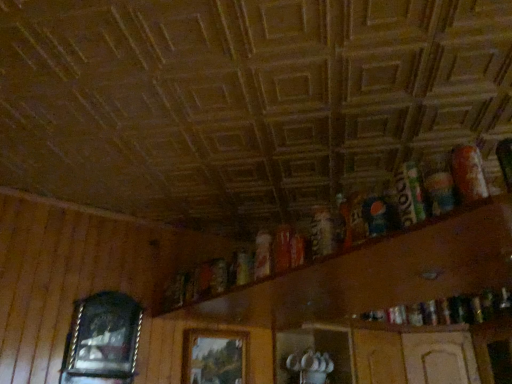
Question: Does wooden cabinet at lower center, which ranks as the first shelf in left-to-right order, have a greater height compared to wooden shelf at upper right, the 2th shelf in the left-to-right sequence?

Choices:
 (A) no
 (B) yes

Answer: (B)

Question: Is wooden cabinet at lower center, marked as the 2th shelf in a right-to-left arrangement, at the left side of wooden shelf at upper right, the 2th shelf in the left-to-right sequence?

Choices:
 (A) no
 (B) yes

Answer: (B)

Question: Is wooden cabinet at lower center, marked as the 2th shelf in a right-to-left arrangement, closer to camera compared to wooden shelf at upper right, the 2th shelf in the left-to-right sequence?

Choices:
 (A) yes
 (B) no

Answer: (B)

Question: Is wooden cabinet at lower center, marked as the 2th shelf in a right-to-left arrangement, outside wooden shelf at upper right, the 2th shelf in the left-to-right sequence?

Choices:
 (A) yes
 (B) no

Answer: (A)

Question: From a real-world perspective, is wooden cabinet at lower center, which ranks as the first shelf in left-to-right order, positioned over wooden shelf at upper right, the 1th shelf from the right, based on gravity?

Choices:
 (A) yes
 (B) no

Answer: (B)

Question: Considering the relative sizes of wooden cabinet at lower center, which ranks as the first shelf in left-to-right order, and wooden shelf at upper right, the 2th shelf in the left-to-right sequence, in the image provided, is wooden cabinet at lower center, which ranks as the first shelf in left-to-right order, wider than wooden shelf at upper right, the 2th shelf in the left-to-right sequence,?

Choices:
 (A) yes
 (B) no

Answer: (B)

Question: Is wooden picture frame at left, the 1th picture frame from the left, outside of wooden picture frame at center, the second picture frame when ordered from left to right?

Choices:
 (A) no
 (B) yes

Answer: (B)

Question: Is wooden picture frame at left, the 1th picture frame from the left, positioned far away from wooden picture frame at center, the second picture frame when ordered from left to right?

Choices:
 (A) yes
 (B) no

Answer: (B)

Question: Can you confirm if wooden picture frame at left, the 1th picture frame from the left, is smaller than wooden picture frame at center, acting as the first picture frame starting from the right?

Choices:
 (A) yes
 (B) no

Answer: (B)

Question: From a real-world perspective, is wooden picture frame at left, the 1th picture frame from the left, located beneath wooden picture frame at center, the second picture frame when ordered from left to right?

Choices:
 (A) yes
 (B) no

Answer: (B)

Question: Is wooden picture frame at left, which is the 2th picture frame from right to left, thinner than wooden picture frame at center, acting as the first picture frame starting from the right?

Choices:
 (A) yes
 (B) no

Answer: (B)

Question: Does wooden picture frame at left, the 1th picture frame from the left, have a greater width compared to wooden picture frame at center, the second picture frame when ordered from left to right?

Choices:
 (A) no
 (B) yes

Answer: (B)

Question: Is wooden picture frame at left, which is the 2th picture frame from right to left, at the back of wooden shelf at upper right, the 1th shelf from the right?

Choices:
 (A) yes
 (B) no

Answer: (B)